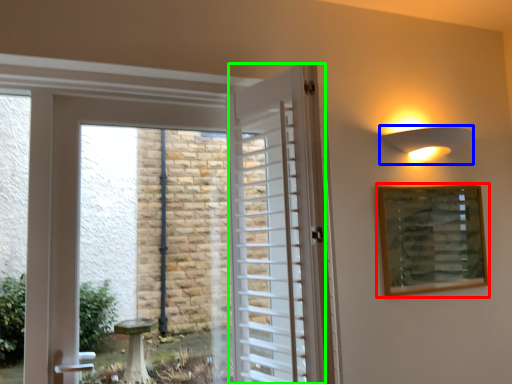
Question: Which is farther away from picture frame (highlighted by a red box)? light fixture (highlighted by a blue box) or door (highlighted by a green box)?

Choices:
 (A) light fixture
 (B) door

Answer: (B)